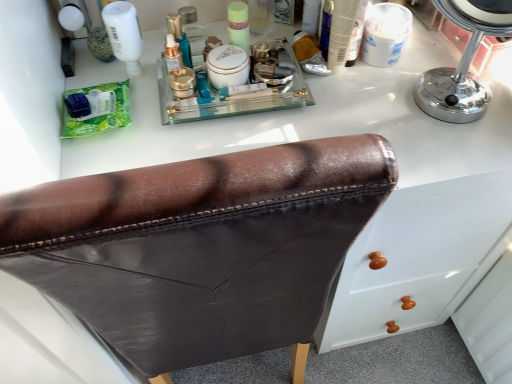
Question: Can you confirm if brown leather chair at center is positioned to the right of matte green jar at center?

Choices:
 (A) yes
 (B) no

Answer: (B)

Question: Considering the relative sizes of brown leather chair at center and matte green jar at center in the image provided, is brown leather chair at center shorter than matte green jar at center?

Choices:
 (A) no
 (B) yes

Answer: (A)

Question: Can you confirm if brown leather chair at center is taller than matte green jar at center?

Choices:
 (A) yes
 (B) no

Answer: (A)

Question: From a real-world perspective, is brown leather chair at center below matte green jar at center?

Choices:
 (A) no
 (B) yes

Answer: (B)

Question: Would you say brown leather chair at center is outside matte green jar at center?

Choices:
 (A) yes
 (B) no

Answer: (A)

Question: Is brown leather chair at center far from matte green jar at center?

Choices:
 (A) no
 (B) yes

Answer: (A)

Question: Can you confirm if green matte packet at left is smaller than chrome/metallic mirror at upper right?

Choices:
 (A) no
 (B) yes

Answer: (B)

Question: Is green matte packet at left oriented away from chrome/metallic mirror at upper right?

Choices:
 (A) no
 (B) yes

Answer: (A)

Question: Is chrome/metallic mirror at upper right surrounded by green matte packet at left?

Choices:
 (A) no
 (B) yes

Answer: (A)

Question: Is green matte packet at left positioned behind chrome/metallic mirror at upper right?

Choices:
 (A) yes
 (B) no

Answer: (A)

Question: Does green matte packet at left touch chrome/metallic mirror at upper right?

Choices:
 (A) no
 (B) yes

Answer: (A)

Question: Is green matte packet at left far from chrome/metallic mirror at upper right?

Choices:
 (A) no
 (B) yes

Answer: (A)

Question: Is brown leather chair at center located outside green matte packet at left?

Choices:
 (A) no
 (B) yes

Answer: (B)